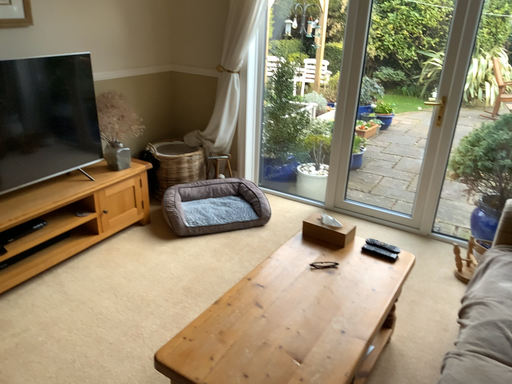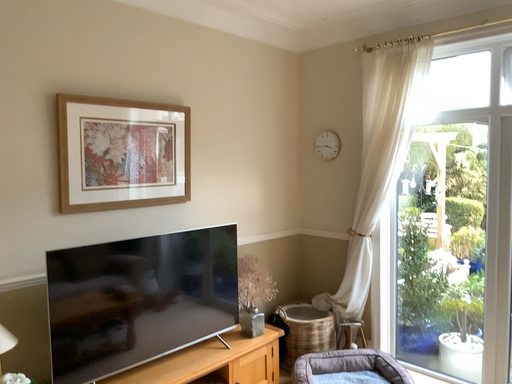
Question: Which way did the camera rotate in the video?

Choices:
 (A) rotated left
 (B) rotated right

Answer: (A)